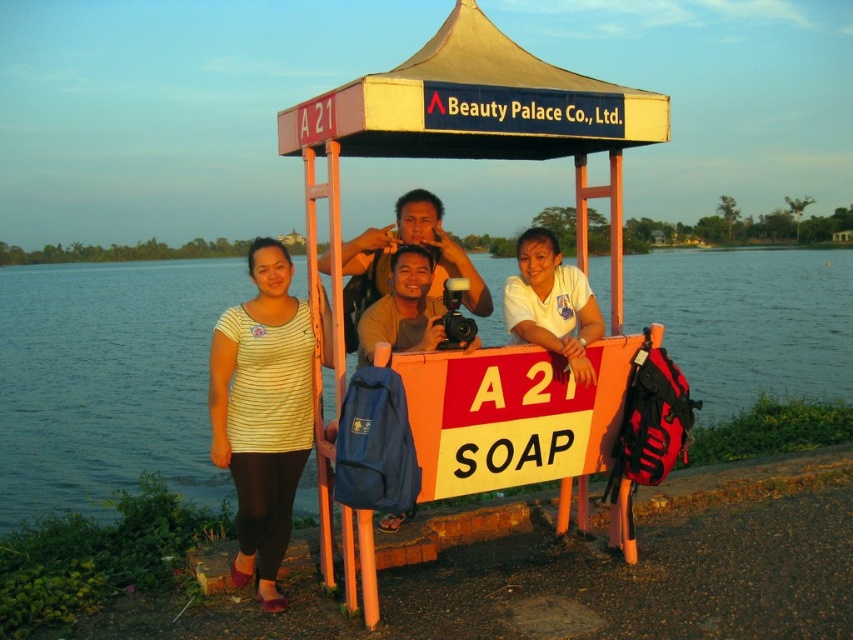
You are standing at the location where the photographer is taking the photo. You want to place a 1.2 meter long pole between the blue water at center and the yellow fabric canopy at upper center. Will the pole fit between them without bending?

The distance between the blue water at center and the yellow fabric canopy at upper center is 15.50 meters, so the 1.2 meter pole will easily fit between them without bending.

Based on the scene description, where is the blue water at center located in terms of coordinates?

The blue water at center is located at coordinates point [106,380].